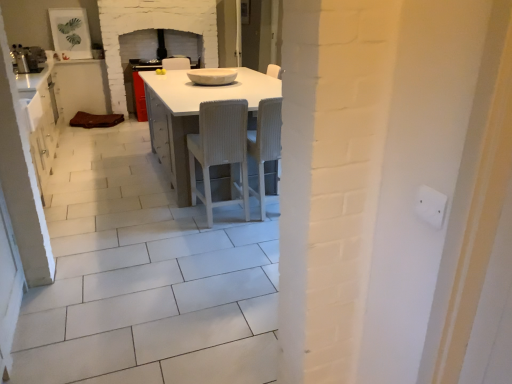
Describe the element at coordinates (220, 151) in the screenshot. This screenshot has height=384, width=512. I see `white ribbed wood chair at center, which is the first chair in left-to-right order` at that location.

Find the location of `white ribbed wood chair at center, which is the first chair in left-to-right order`. white ribbed wood chair at center, which is the first chair in left-to-right order is located at coordinates (220, 151).

The image size is (512, 384). In order to click on white glossy table at center in this screenshot , I will do `click(193, 115)`.

From the image's perspective, which is below, white plastic electric outlet at upper right or white textured chair at center, which appears as the first chair when viewed from the right?

white plastic electric outlet at upper right, from the image's perspective.

Is white plastic electric outlet at upper right inside the boundaries of white textured chair at center, which appears as the first chair when viewed from the right, or outside?

white plastic electric outlet at upper right is not enclosed by white textured chair at center, which appears as the first chair when viewed from the right.

Is point (443, 210) closer or farther from the camera than point (249, 143)?

Point (443, 210) is closer to the camera than point (249, 143).

In the image, is white glossy table at center positioned in front of or behind white textured chair at center, which appears as the first chair when viewed from the right?

white glossy table at center is positioned farther from the viewer than white textured chair at center, which appears as the first chair when viewed from the right.

From a real-world perspective, is white glossy table at center beneath white textured chair at center, the second chair when ordered from left to right?

Yes.

From the image's perspective, which is below, white textured chair at center, the second chair when ordered from left to right, or brown leather cushion at left?

From the image's view, white textured chair at center, the second chair when ordered from left to right, is below.

Choose the correct answer: Is white textured chair at center, which appears as the first chair when viewed from the right, inside brown leather cushion at left or outside it?

white textured chair at center, which appears as the first chair when viewed from the right, is outside brown leather cushion at left.

In the scene shown: From a real-world perspective, does white textured chair at center, the second chair when ordered from left to right, stand above brown leather cushion at left?

Indeed, from a real-world perspective, white textured chair at center, the second chair when ordered from left to right, stands above brown leather cushion at left.

Which of these two, white textured chair at center, which appears as the first chair when viewed from the right, or brown leather cushion at left, is thinner?

white textured chair at center, which appears as the first chair when viewed from the right, is thinner.

Is point (234, 77) positioned in front of point (426, 198)?

That is False.

Consider the image. From a real-world perspective, is white glossy bowl at center on white plastic electric outlet at upper right?

No, from a real-world perspective, white glossy bowl at center is not on top of white plastic electric outlet at upper right.

From the image's perspective, between white glossy bowl at center and white plastic electric outlet at upper right, which one is located above?

white glossy bowl at center is shown above in the image.

Measure the distance between white glossy bowl at center and white plastic electric outlet at upper right.

white glossy bowl at center and white plastic electric outlet at upper right are 3.48 meters apart from each other.

Who is taller, brown leather cushion at left or white textured chair at center, which appears as the first chair when viewed from the right?

white textured chair at center, which appears as the first chair when viewed from the right.

Find the location of a particular element. the 1st chair positioned below the brown leather cushion at left (from the image's perspective) is located at coordinates (265, 143).

From the picture: Could white textured chair at center, the second chair when ordered from left to right, be considered to be inside brown leather cushion at left?

That's incorrect, white textured chair at center, the second chair when ordered from left to right, is not inside brown leather cushion at left.

Is point (54, 69) positioned before point (259, 126)?

No, it is behind (259, 126).

Does white glossy bowl at center have a smaller size compared to white ribbed wood chair at center, which is the 2th chair from right to left?

Yes.

Could you measure the distance between white glossy bowl at center and white ribbed wood chair at center, which is the 2th chair from right to left?

white glossy bowl at center is 3.80 feet away from white ribbed wood chair at center, which is the 2th chair from right to left.

What's the angular difference between white glossy bowl at center and white ribbed wood chair at center, which is the 2th chair from right to left,'s facing directions?

88.6 degrees separate the facing orientations of white glossy bowl at center and white ribbed wood chair at center, which is the 2th chair from right to left.

Is white glossy bowl at center positioned far away from white ribbed wood chair at center, which is the first chair in left-to-right order?

white glossy bowl at center is far away from white ribbed wood chair at center, which is the first chair in left-to-right order.

Is brown leather cushion at left oriented away from white glossy table at center?

brown leather cushion at left does not have its back to white glossy table at center.

Measure the distance between brown leather cushion at left and white glossy table at center.

A distance of 3.00 meters exists between brown leather cushion at left and white glossy table at center.

Does brown leather cushion at left have a larger size compared to white glossy table at center?

Actually, brown leather cushion at left might be smaller than white glossy table at center.

From the image's perspective, which is below, brown leather cushion at left or white glossy table at center?

white glossy table at center.

Locate an element on the screen. electric outlet in front of the white textured chair at center, the second chair when ordered from left to right is located at coordinates (430, 205).

There is a white glossy table at center. At what (x,y) coordinates should I click in order to perform the action: click on the 1st chair above it (from a real-world perspective). Please return your answer as a coordinate pair (x, y). Image resolution: width=512 pixels, height=384 pixels. Looking at the image, I should click on (265, 143).

Estimate the real-world distances between objects in this image. Which object is further from white glossy table at center, white glossy bowl at center or white ribbed wood chair at center, which is the 2th chair from right to left?

Based on the image, white glossy bowl at center appears to be further to white glossy table at center.

When comparing their distances from brown leather cushion at left, does white glossy table at center or white glossy bowl at center seem further?

white glossy table at center is further to brown leather cushion at left.

Estimate the real-world distances between objects in this image. Which object is further from brown leather cushion at left, white ribbed wood chair at center, which is the first chair in left-to-right order, or white plastic electric outlet at upper right?

white plastic electric outlet at upper right.

Looking at the image, which one is located closer to white glossy bowl at center, brown leather cushion at left or white textured chair at center, the second chair when ordered from left to right?

The object closer to white glossy bowl at center is white textured chair at center, the second chair when ordered from left to right.

Estimate the real-world distances between objects in this image. Which object is further from brown leather cushion at left, white plastic electric outlet at upper right or white glossy bowl at center?

white plastic electric outlet at upper right lies further to brown leather cushion at left than the other object.

Looking at the image, which one is located further to white textured chair at center, the second chair when ordered from left to right, white ribbed wood chair at center, which is the first chair in left-to-right order, or white plastic electric outlet at upper right?

Among the two, white plastic electric outlet at upper right is located further to white textured chair at center, the second chair when ordered from left to right.

When comparing their distances from brown leather cushion at left, does white textured chair at center, which appears as the first chair when viewed from the right, or white glossy table at center seem further?

The object further to brown leather cushion at left is white textured chair at center, which appears as the first chair when viewed from the right.

Estimate the real-world distances between objects in this image. Which object is closer to brown leather cushion at left, white glossy bowl at center or white ribbed wood chair at center, which is the first chair in left-to-right order?

white glossy bowl at center is closer to brown leather cushion at left.

At what (x,y) coordinates should I click in order to perform the action: click on table positioned between white textured chair at center, which appears as the first chair when viewed from the right, and white glossy bowl at center from near to far. Please return your answer as a coordinate pair (x, y). Looking at the image, I should click on (193, 115).

The image size is (512, 384). What are the coordinates of `table positioned between white ribbed wood chair at center, which is the first chair in left-to-right order, and brown leather cushion at left from near to far` in the screenshot? It's located at (193, 115).

Identify the location of appliance between white textured chair at center, which appears as the first chair when viewed from the right, and brown leather cushion at left in the front-back direction. The image size is (512, 384). (212, 76).

Identify the location of table between white plastic electric outlet at upper right and brown leather cushion at left in the front-back direction. (193, 115).